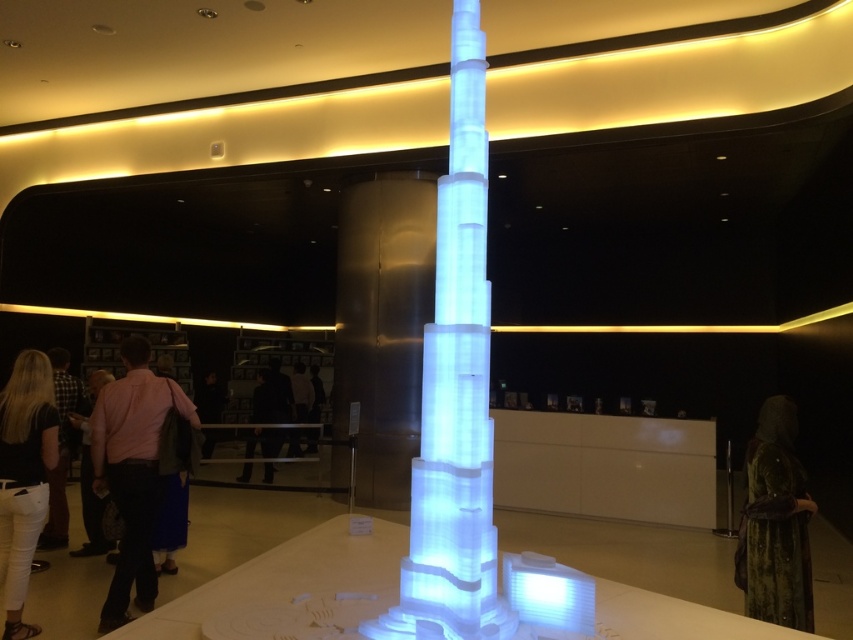
You are an architect examining the skyscraper model in the museum. You notice two points marked on the model at coordinates point (143, 460) and point (103, 378). Which point is positioned closer to your viewpoint as you face the model?

Point (143, 460) is closer to the viewer than point (103, 378) based on their coordinates.

You are an artist setting up an exhibition and need to arrange two pink shirts in the museum. You have a pink fabric shirt at center and a pink shirt at left. Which shirt should you place higher to ensure they are aligned vertically?

The pink fabric shirt at center is much taller than the pink shirt at left, so to align them vertically, you should place the pink shirt at left higher than the pink fabric shirt at center.

You are an art curator examining the icy white plastic tower at center and the pink shirt at left in the museum. Which object has a smaller width?

The icy white plastic tower at center is thinner than the pink shirt at left, so the icy white plastic tower at center has a smaller width.